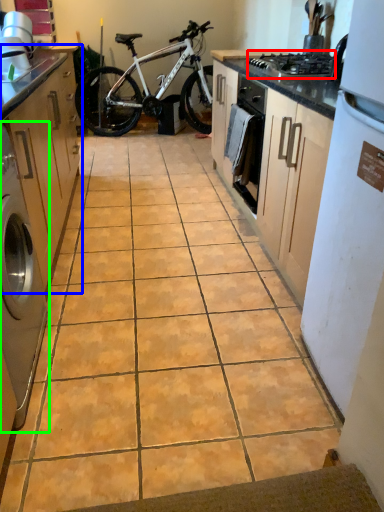
Question: Estimate the real-world distances between objects in this image. Which object is farther from gas stove (highlighted by a red box), cabinetry (highlighted by a blue box) or home appliance (highlighted by a green box)?

Choices:
 (A) cabinetry
 (B) home appliance

Answer: (B)